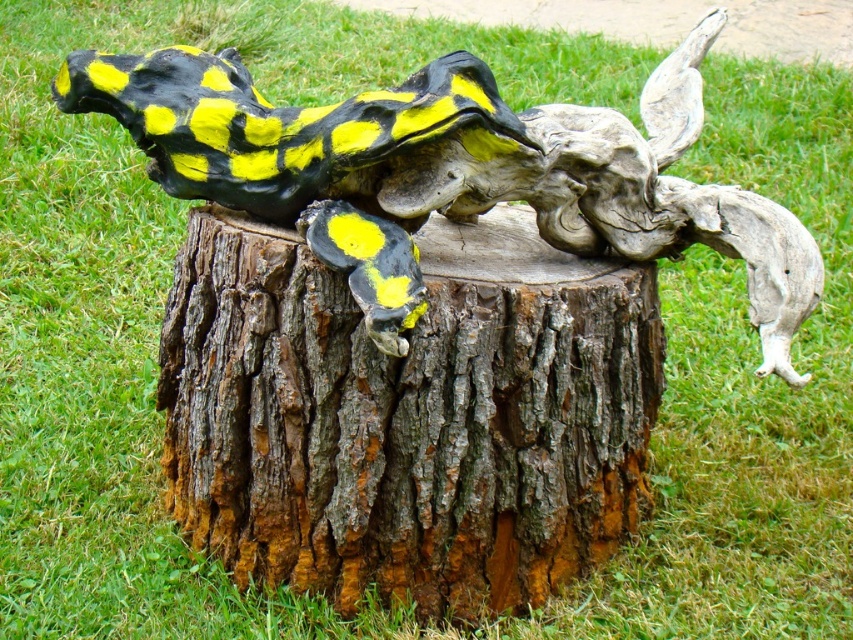
You are an artist standing in front of the sculpture. You want to paint a new layer on the rough bark tree stump at center so that it appears closer to you. However, you can only paint on the matte black and yellow spotted lizard at center. Is this possible?

The rough bark tree stump at center is already further to the viewer than the matte black and yellow spotted lizard at center, so painting on the lizard would not make the stump appear closer since they are at different depths.